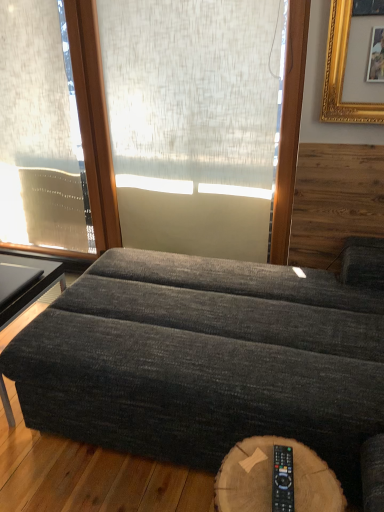
Question: Considering the relative sizes of black plastic remote at lower right and dark gray fabric ottoman at lower left in the image provided, is black plastic remote at lower right taller than dark gray fabric ottoman at lower left?

Choices:
 (A) no
 (B) yes

Answer: (A)

Question: From the image's perspective, is black plastic remote at lower right located beneath dark gray fabric ottoman at lower left?

Choices:
 (A) yes
 (B) no

Answer: (A)

Question: Is black plastic remote at lower right oriented away from dark gray fabric ottoman at lower left?

Choices:
 (A) yes
 (B) no

Answer: (B)

Question: Is black plastic remote at lower right behind dark gray fabric ottoman at lower left?

Choices:
 (A) no
 (B) yes

Answer: (A)

Question: Is black plastic remote at lower right facing towards dark gray fabric ottoman at lower left?

Choices:
 (A) yes
 (B) no

Answer: (B)

Question: Can you confirm if black plastic remote at lower right is positioned to the left of dark gray fabric ottoman at lower left?

Choices:
 (A) yes
 (B) no

Answer: (B)

Question: Does translucent beige curtain at left have a lesser height compared to black plastic remote at lower right?

Choices:
 (A) yes
 (B) no

Answer: (B)

Question: Is translucent beige curtain at left positioned behind black plastic remote at lower right?

Choices:
 (A) yes
 (B) no

Answer: (A)

Question: Does translucent beige curtain at left have a larger size compared to black plastic remote at lower right?

Choices:
 (A) no
 (B) yes

Answer: (B)

Question: Is translucent beige curtain at left positioned beyond the bounds of black plastic remote at lower right?

Choices:
 (A) yes
 (B) no

Answer: (A)

Question: Is translucent beige curtain at left oriented towards black plastic remote at lower right?

Choices:
 (A) yes
 (B) no

Answer: (B)

Question: Is translucent beige curtain at left smaller than black plastic remote at lower right?

Choices:
 (A) yes
 (B) no

Answer: (B)

Question: Considering the relative sizes of white textured screen at center and dark gray fabric ottoman at lower left in the image provided, is white textured screen at center wider than dark gray fabric ottoman at lower left?

Choices:
 (A) no
 (B) yes

Answer: (A)